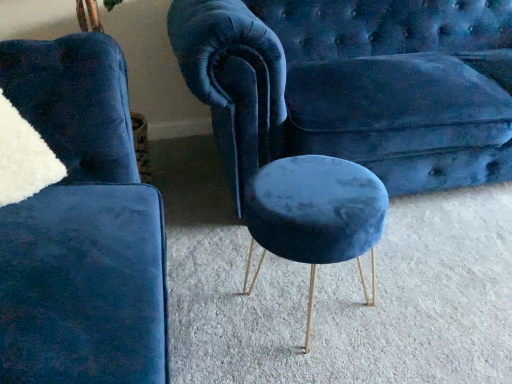
Question: From their relative heights in the image, would you say velvet blue stool at center is taller or shorter than velvet blue couch at center?

Choices:
 (A) short
 (B) tall

Answer: (A)

Question: Is velvet blue stool at center to the left or to the right of velvet blue couch at center in the image?

Choices:
 (A) right
 (B) left

Answer: (B)

Question: Which of these objects is positioned closest to the velvet blue stool at center?

Choices:
 (A) velvet blue stool at lower left
 (B) velvet blue couch at center

Answer: (A)

Question: Which object is positioned farthest from the velvet blue stool at center?

Choices:
 (A) velvet blue couch at center
 (B) velvet blue stool at lower left

Answer: (A)